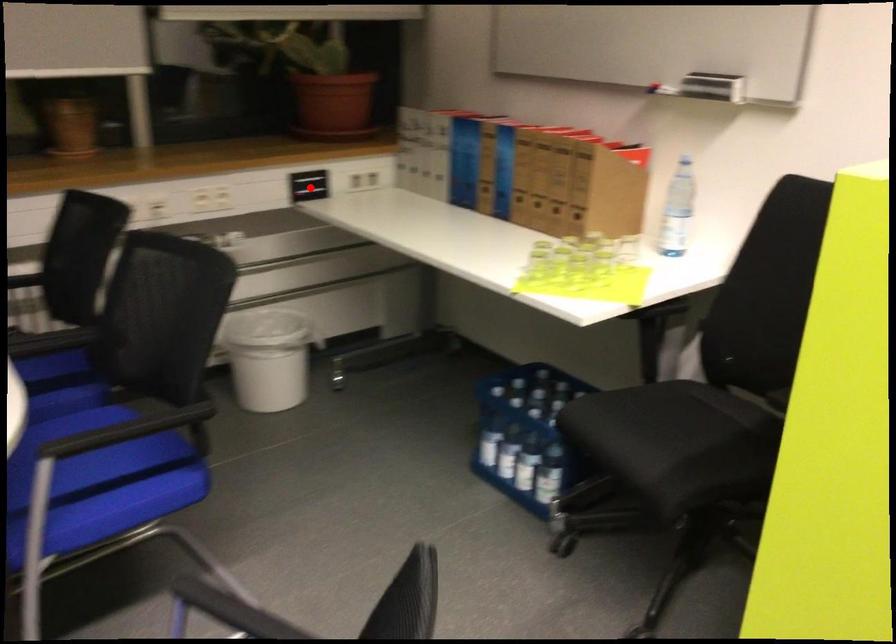
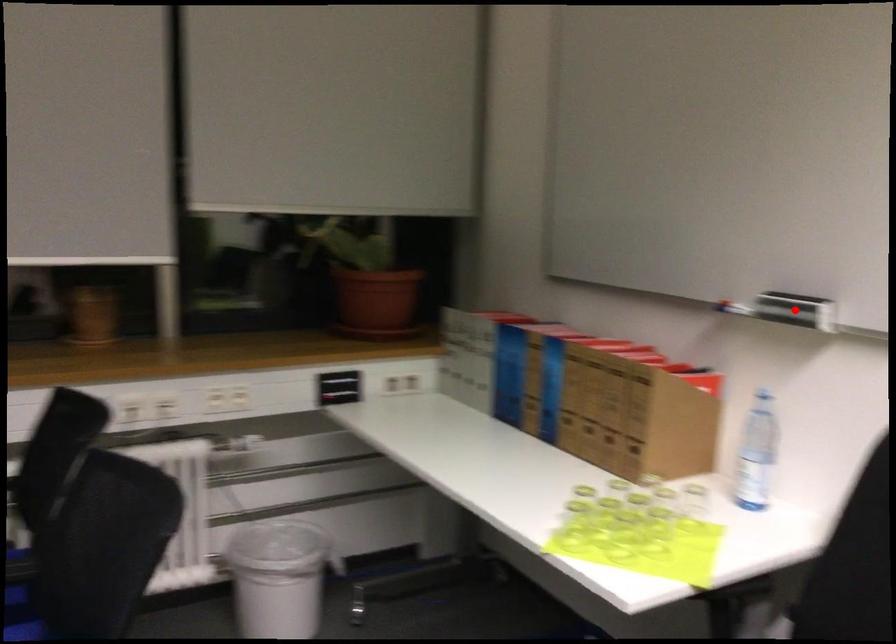
I am providing you with two images of the same scene from different viewpoints. A red point is marked on the first image and another point is marked on the second image. Is the marked point in image1 the same physical position as the marked point in image2?

No